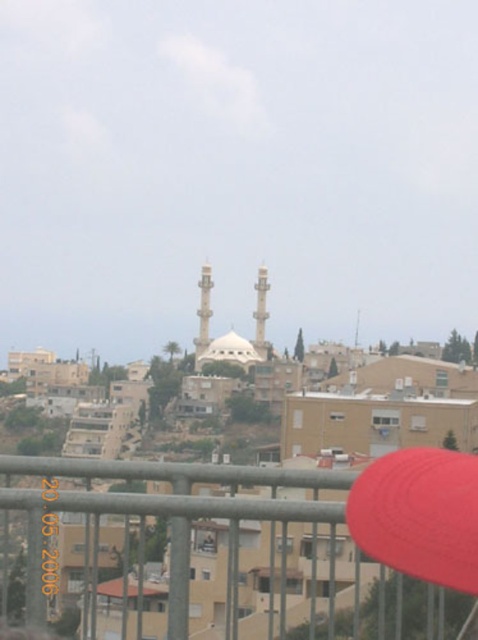
Consider the image. You are standing on a balcony overlooking the residential area with the mosque in the background. You see the metallic gray rail at lower center and the red matte baseball hat at lower right. Which object is wider?

The metallic gray rail at lower center is wider than the red matte baseball hat at lower right.

You are standing at the edge of a balcony overlooking a residential area with a mosque in the background. You notice a metallic gray rail at lower center and a red matte baseball hat at lower right. Which object is taller?

The metallic gray rail at lower center is much taller than the red matte baseball hat at lower right.

You are standing at the edge of a balcony in the residential area and want to know the exact coordinates of the metallic gray rail at lower center. What are its coordinates?

The metallic gray rail at lower center is located at coordinates point (225, 547).